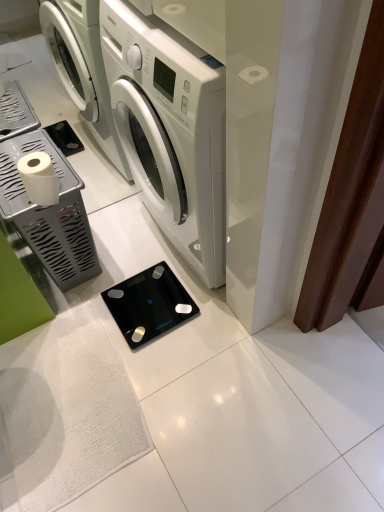
Question: From the image's perspective, is white matte toilet paper at left on top of white glossy washing machine at center?

Choices:
 (A) yes
 (B) no

Answer: (B)

Question: Is white matte toilet paper at left facing towards white glossy washing machine at center?

Choices:
 (A) yes
 (B) no

Answer: (A)

Question: From a real-world perspective, is white matte toilet paper at left positioned over white glossy washing machine at center based on gravity?

Choices:
 (A) yes
 (B) no

Answer: (A)

Question: Considering the relative sizes of white matte toilet paper at left and white glossy washing machine at center in the image provided, is white matte toilet paper at left wider than white glossy washing machine at center?

Choices:
 (A) no
 (B) yes

Answer: (A)

Question: Considering the relative sizes of white matte toilet paper at left and white glossy washing machine at center in the image provided, is white matte toilet paper at left shorter than white glossy washing machine at center?

Choices:
 (A) yes
 (B) no

Answer: (A)

Question: From the image's perspective, is white matte toilet paper at left beneath white glossy washing machine at center?

Choices:
 (A) yes
 (B) no

Answer: (A)

Question: Is white matte toilet paper at left oriented away from silver metallic toilet paper holder at left, placed as the 1th appliance when sorted from left to right?

Choices:
 (A) no
 (B) yes

Answer: (A)

Question: From a real-world perspective, is white matte toilet paper at left located beneath silver metallic toilet paper holder at left, placed as the 1th appliance when sorted from left to right?

Choices:
 (A) yes
 (B) no

Answer: (B)

Question: Does white matte toilet paper at left turn towards silver metallic toilet paper holder at left, which is counted as the 2th appliance, starting from the right?

Choices:
 (A) no
 (B) yes

Answer: (A)

Question: From the image's perspective, does white matte toilet paper at left appear lower than silver metallic toilet paper holder at left, which is counted as the 2th appliance, starting from the right?

Choices:
 (A) no
 (B) yes

Answer: (A)

Question: From the image's perspective, is white matte toilet paper at left on top of silver metallic toilet paper holder at left, which is counted as the 2th appliance, starting from the right?

Choices:
 (A) no
 (B) yes

Answer: (B)

Question: Considering the relative positions of white matte toilet paper at left and silver metallic toilet paper holder at left, placed as the 1th appliance when sorted from left to right, in the image provided, is white matte toilet paper at left in front of silver metallic toilet paper holder at left, placed as the 1th appliance when sorted from left to right,?

Choices:
 (A) no
 (B) yes

Answer: (B)

Question: Considering the relative positions of white glossy washing machine at center and black glass scale at center, acting as the first appliance starting from the right, in the image provided, is white glossy washing machine at center in front of black glass scale at center, acting as the first appliance starting from the right,?

Choices:
 (A) yes
 (B) no

Answer: (A)